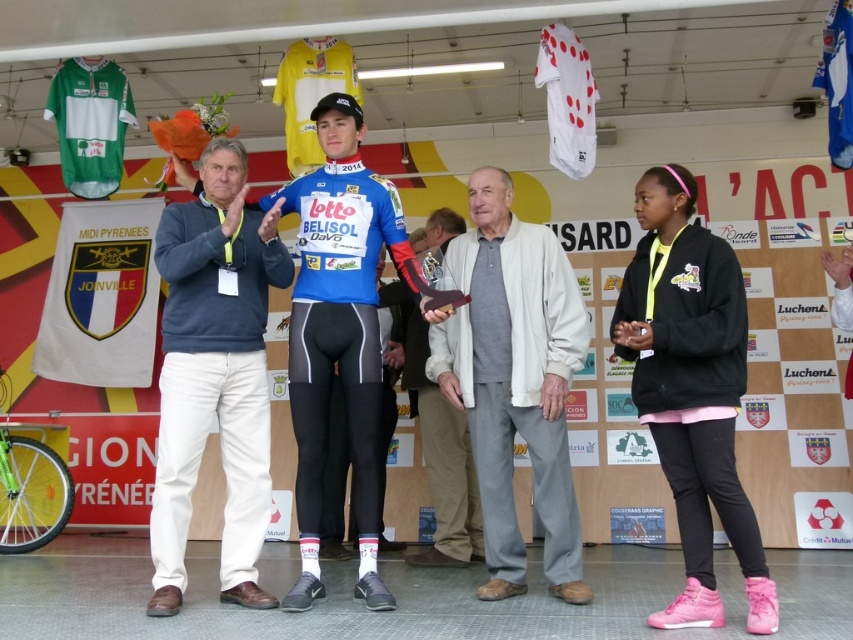
You are a photographer at the podium ceremony. You need to take a photo of the cyclist in the blue and red Lotto Belisol jersey and the white cotton jacket at center. Where should you position your camera to ensure both subjects are in frame?

The white cotton jacket at center is located at point (514, 380). Since the cyclist in the blue and red Lotto Belisol jersey is also at the center, positioning the camera at the center of the scene will ensure both subjects are in frame.